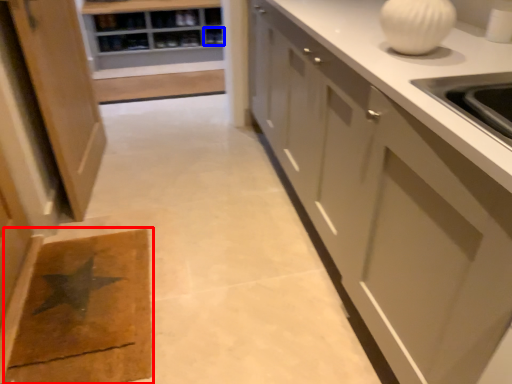
Question: Among these objects, which one is nearest to the camera, doormat (highlighted by a red box) or shelf (highlighted by a blue box)?

Choices:
 (A) doormat
 (B) shelf

Answer: (A)